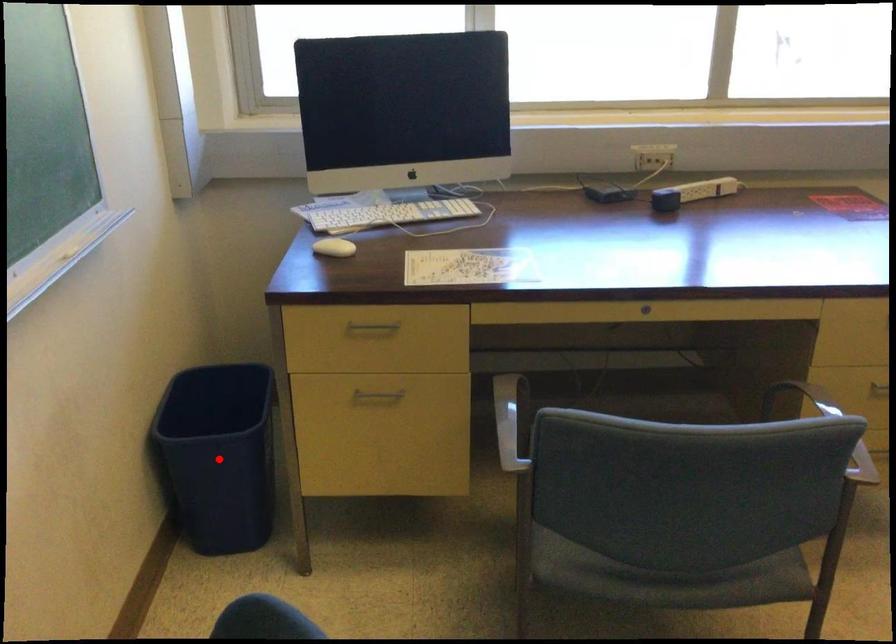
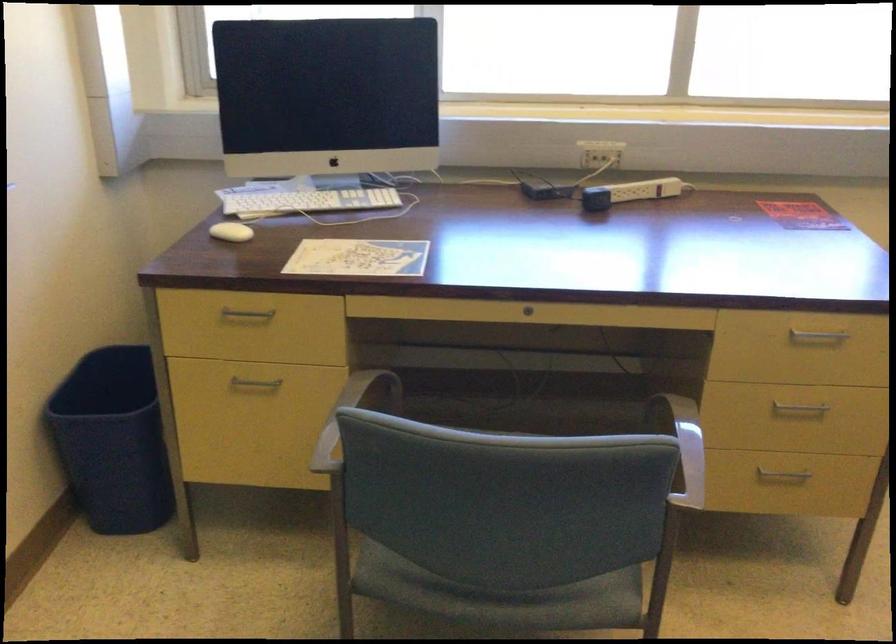
Locate, in the second image, the point that corresponds to the highlighted location in the first image.

(113, 440)